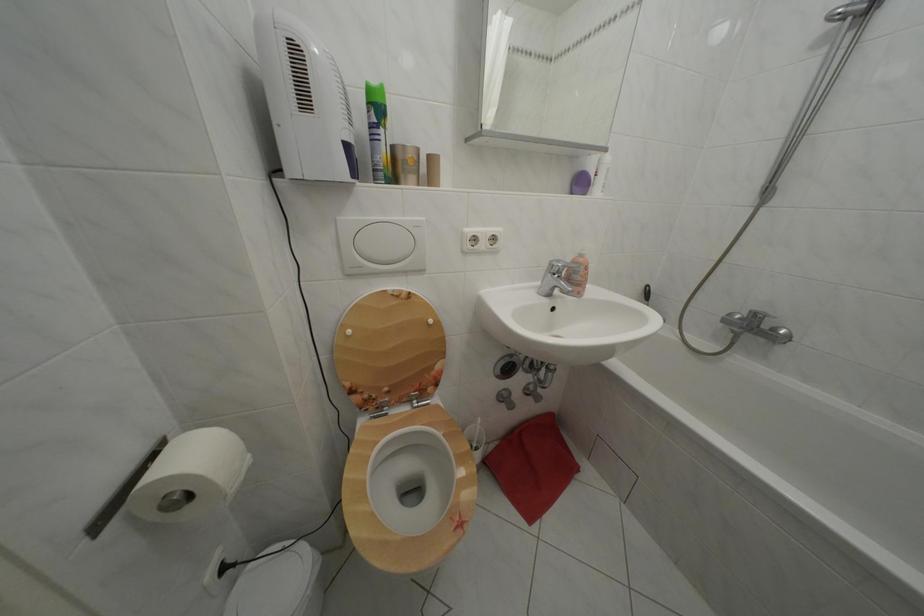
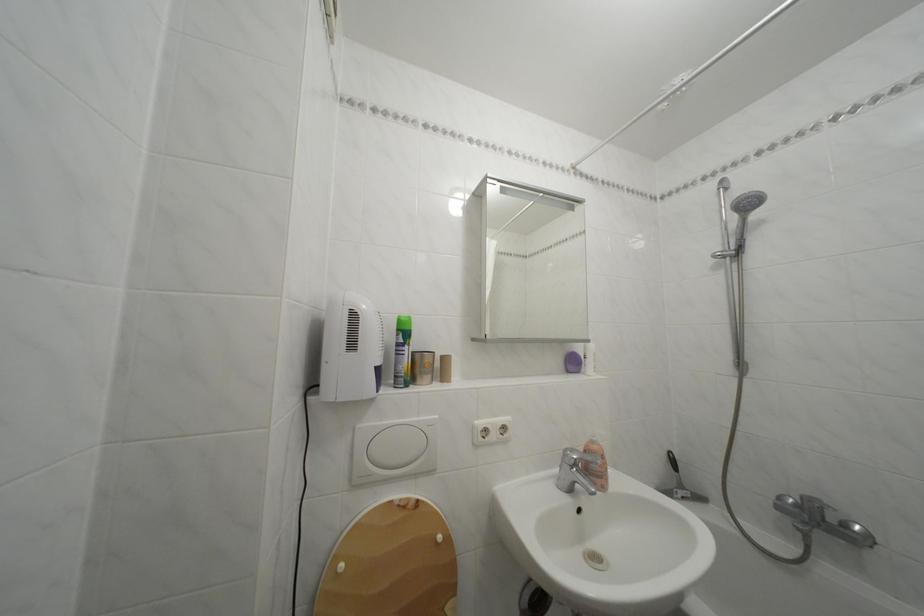
The point at (x=590, y=262) is marked in the first image. Where is the corresponding point in the second image?

(602, 448)